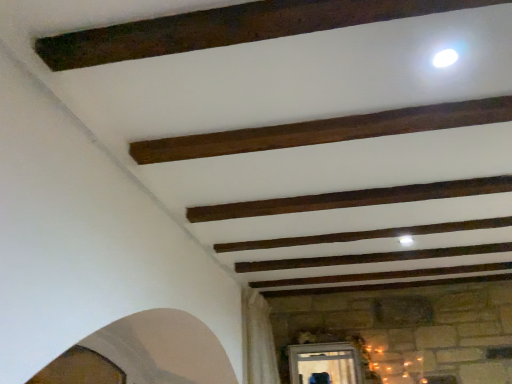
What do you see at coordinates (324, 130) in the screenshot? I see `dark brown wood plank at upper center, acting as the 1th plank starting from the top` at bounding box center [324, 130].

I want to click on dark brown wood plank at upper center, which is the 2th plank from bottom to top, so click(x=324, y=130).

The image size is (512, 384). What do you see at coordinates (351, 199) in the screenshot?
I see `dark brown wood plank at center, which appears as the 1th plank when ordered from the bottom` at bounding box center [351, 199].

In order to face dark brown wood plank at center, which appears as the 2th plank when viewed from the top, should I rotate leftwards or rightwards?

You should rotate right by 12.158 degrees.

Measure the distance between dark brown wood plank at center, which appears as the 1th plank when ordered from the bottom, and camera.

They are 1.57 meters apart.

I want to click on dark brown wood plank at center, the second plank viewed from the front, so click(x=351, y=199).

Locate an element on the screen. dark brown wood plank at upper center, which is counted as the 1th plank, starting from the front is located at coordinates tap(324, 130).

Considering the positions of objects dark brown wood plank at upper center, acting as the 1th plank starting from the top, and dark brown wood plank at center, the second plank viewed from the front, in the image provided, who is more to the left, dark brown wood plank at upper center, acting as the 1th plank starting from the top, or dark brown wood plank at center, the second plank viewed from the front,?

Positioned to the left is dark brown wood plank at upper center, acting as the 1th plank starting from the top.

Consider the image. Which object is more forward, dark brown wood plank at upper center, which is counted as the 1th plank, starting from the front, or dark brown wood plank at center, the second plank viewed from the front?

dark brown wood plank at upper center, which is counted as the 1th plank, starting from the front, is closer to the camera.

Is point (194, 139) farther from viewer compared to point (362, 203)?

No.

From the image's perspective, between dark brown wood plank at upper center, which is the 2th plank from bottom to top, and dark brown wood plank at center, which appears as the 1th plank when ordered from the bottom, who is located below?

From the image's view, dark brown wood plank at center, which appears as the 1th plank when ordered from the bottom, is below.

From a real-world perspective, is dark brown wood plank at upper center, acting as the 1th plank starting from the top, physically above dark brown wood plank at center, which appears as the 2th plank when viewed from the top?

Result: Yes, from a real-world perspective, dark brown wood plank at upper center, acting as the 1th plank starting from the top, is on top of dark brown wood plank at center, which appears as the 2th plank when viewed from the top.

Is dark brown wood plank at upper center, which is counted as the 1th plank, starting from the front, wider or thinner than dark brown wood plank at center, the second plank viewed from the front?

dark brown wood plank at upper center, which is counted as the 1th plank, starting from the front, is wider than dark brown wood plank at center, the second plank viewed from the front.

Between dark brown wood plank at upper center, acting as the 1th plank starting from the top, and dark brown wood plank at center, the second plank viewed from the front, which one has more height?

With more height is dark brown wood plank at center, the second plank viewed from the front.

Can you confirm if dark brown wood plank at upper center, acting as the 1th plank starting from the top, is bigger than dark brown wood plank at center, which appears as the 2th plank when viewed from the top?

Incorrect, dark brown wood plank at upper center, acting as the 1th plank starting from the top, is not larger than dark brown wood plank at center, which appears as the 2th plank when viewed from the top.

Would you say dark brown wood plank at upper center, which is counted as the 1th plank, starting from the front, is inside or outside dark brown wood plank at center, the 1th plank in the back-to-front sequence?

dark brown wood plank at upper center, which is counted as the 1th plank, starting from the front, cannot be found inside dark brown wood plank at center, the 1th plank in the back-to-front sequence.

Is dark brown wood plank at upper center, which is the 2th plank from bottom to top, positioned far away from dark brown wood plank at center, which appears as the 1th plank when ordered from the bottom?

No, dark brown wood plank at upper center, which is the 2th plank from bottom to top, is not far from dark brown wood plank at center, which appears as the 1th plank when ordered from the bottom.

Is dark brown wood plank at upper center, which is the 2th plank from bottom to top, oriented away from dark brown wood plank at center, the 1th plank in the back-to-front sequence?

Yes, dark brown wood plank at upper center, which is the 2th plank from bottom to top, is positioned with its back facing dark brown wood plank at center, the 1th plank in the back-to-front sequence.

Can you tell me how much dark brown wood plank at upper center, which is counted as the 1th plank, starting from the front, and dark brown wood plank at center, the 1th plank in the back-to-front sequence, differ in facing direction?

There is a 0.000665-degree angle between the facing directions of dark brown wood plank at upper center, which is counted as the 1th plank, starting from the front, and dark brown wood plank at center, the 1th plank in the back-to-front sequence.

At what (x,y) coordinates should I click in order to perform the action: click on plank on the left of dark brown wood plank at center, the second plank viewed from the front. Please return your answer as a coordinate pair (x, y). This screenshot has height=384, width=512. Looking at the image, I should click on (324, 130).

Which is more to the right, dark brown wood plank at center, the second plank viewed from the front, or dark brown wood plank at upper center, positioned as the second plank in back-to-front order?

Positioned to the right is dark brown wood plank at center, the second plank viewed from the front.

Which object is closer to the camera, dark brown wood plank at center, the 1th plank in the back-to-front sequence, or dark brown wood plank at upper center, which is counted as the 1th plank, starting from the front?

dark brown wood plank at upper center, which is counted as the 1th plank, starting from the front, is more forward.

Which is farther, (x=355, y=199) or (x=297, y=131)?

The point (x=355, y=199) is farther from the camera.

From the image's perspective, which object appears higher, dark brown wood plank at center, the 1th plank in the back-to-front sequence, or dark brown wood plank at upper center, which is the 2th plank from bottom to top?

dark brown wood plank at upper center, which is the 2th plank from bottom to top, from the image's perspective.

From a real-world perspective, is dark brown wood plank at center, the second plank viewed from the front, over dark brown wood plank at upper center, acting as the 1th plank starting from the top?

Actually, dark brown wood plank at center, the second plank viewed from the front, is physically below dark brown wood plank at upper center, acting as the 1th plank starting from the top, in the real world.

Looking at this image, which object is thinner, dark brown wood plank at center, the second plank viewed from the front, or dark brown wood plank at upper center, positioned as the second plank in back-to-front order?

With smaller width is dark brown wood plank at center, the second plank viewed from the front.

In terms of height, does dark brown wood plank at center, which appears as the 2th plank when viewed from the top, look taller or shorter compared to dark brown wood plank at upper center, which is the 2th plank from bottom to top?

Considering their sizes, dark brown wood plank at center, which appears as the 2th plank when viewed from the top, has more height than dark brown wood plank at upper center, which is the 2th plank from bottom to top.

Does dark brown wood plank at center, the second plank viewed from the front, have a smaller size compared to dark brown wood plank at upper center, positioned as the second plank in back-to-front order?

Actually, dark brown wood plank at center, the second plank viewed from the front, might be larger than dark brown wood plank at upper center, positioned as the second plank in back-to-front order.

Is dark brown wood plank at center, the 1th plank in the back-to-front sequence, spatially inside dark brown wood plank at upper center, acting as the 1th plank starting from the top, or outside of it?

dark brown wood plank at center, the 1th plank in the back-to-front sequence, is not enclosed by dark brown wood plank at upper center, acting as the 1th plank starting from the top.

Is the surface of dark brown wood plank at center, the 1th plank in the back-to-front sequence, in direct contact with dark brown wood plank at upper center, positioned as the second plank in back-to-front order?

No, dark brown wood plank at center, the 1th plank in the back-to-front sequence, is not with dark brown wood plank at upper center, positioned as the second plank in back-to-front order.

In the scene shown: Is dark brown wood plank at center, the 1th plank in the back-to-front sequence, oriented towards dark brown wood plank at upper center, positioned as the second plank in back-to-front order?

Yes, dark brown wood plank at center, the 1th plank in the back-to-front sequence, is oriented towards dark brown wood plank at upper center, positioned as the second plank in back-to-front order.

Can you tell me how much dark brown wood plank at center, which appears as the 2th plank when viewed from the top, and dark brown wood plank at upper center, which is counted as the 1th plank, starting from the front, differ in facing direction?

There is a 0.000665-degree angle between the facing directions of dark brown wood plank at center, which appears as the 2th plank when viewed from the top, and dark brown wood plank at upper center, which is counted as the 1th plank, starting from the front.

Image resolution: width=512 pixels, height=384 pixels. I want to click on plank located on the right of dark brown wood plank at upper center, which is the 2th plank from bottom to top, so click(x=351, y=199).

Image resolution: width=512 pixels, height=384 pixels. Identify the location of plank lying in front of the dark brown wood plank at center, which appears as the 2th plank when viewed from the top. (324, 130).

Locate an element on the screen. The image size is (512, 384). plank that is under the dark brown wood plank at upper center, which is counted as the 1th plank, starting from the front (from a real-world perspective) is located at coordinates (351, 199).